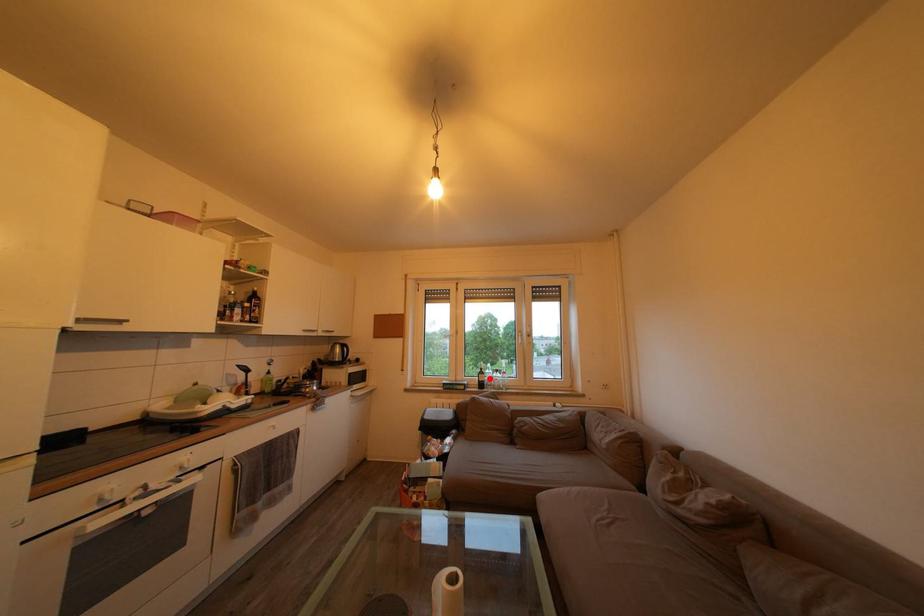
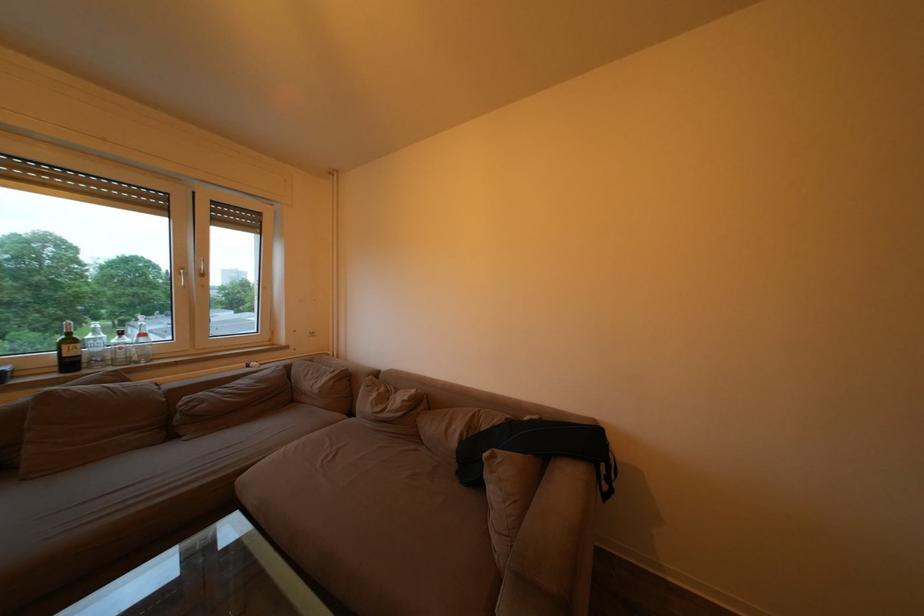
Question: A red point is marked in image1. In image2, is the corresponding 3D point closer to the camera or farther? Reply with the corresponding letter.

Choices:
 (A) The corresponding 3D point is closer.
 (B) The corresponding 3D point is farther.

Answer: (A)